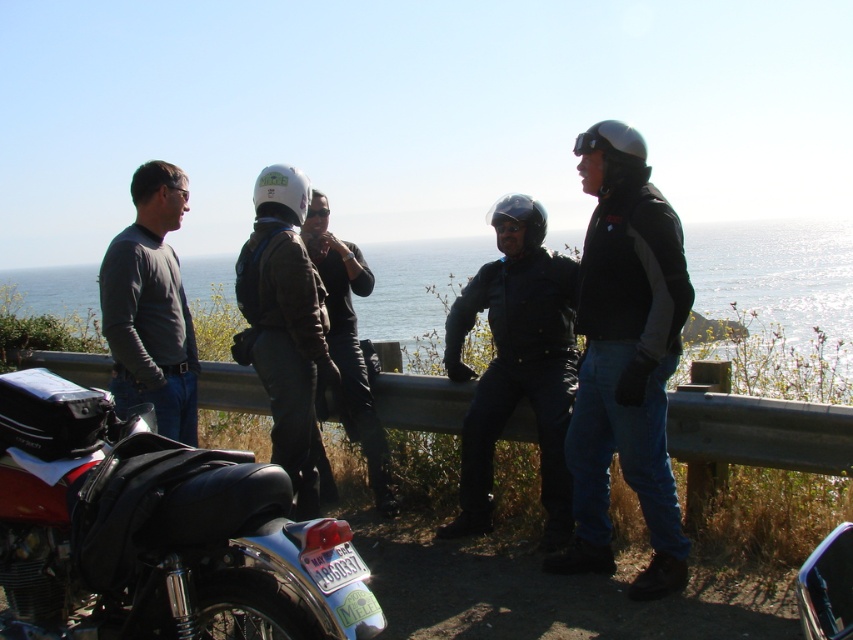
Does black matte jacket at center have a lesser width compared to black leather jacket at center?

Indeed, black matte jacket at center has a lesser width compared to black leather jacket at center.

Image resolution: width=853 pixels, height=640 pixels. In order to click on black matte jacket at center in this screenshot , I will do `click(625, 358)`.

This screenshot has width=853, height=640. I want to click on black matte jacket at center, so click(625, 358).

Does black matte jacket at center appear over matte black jacket at left?

Incorrect, black matte jacket at center is not positioned above matte black jacket at left.

Between point (677, 362) and point (149, 218), which one is positioned behind?

The point (149, 218) is behind.

Who is more distant from viewer, (627,212) or (160,397)?

Point (160,397)

Image resolution: width=853 pixels, height=640 pixels. In order to click on black matte jacket at center in this screenshot , I will do `click(625, 358)`.

Can you confirm if black leather jacket at center is positioned to the right of white matte helmet at center?

Indeed, black leather jacket at center is positioned on the right side of white matte helmet at center.

Does point (488, 400) lie behind point (270, 182)?

Yes, point (488, 400) is farther from viewer.

At what (x,y) coordinates should I click in order to perform the action: click on black leather jacket at center. Please return your answer as a coordinate pair (x, y). This screenshot has height=640, width=853. Looking at the image, I should click on (515, 364).